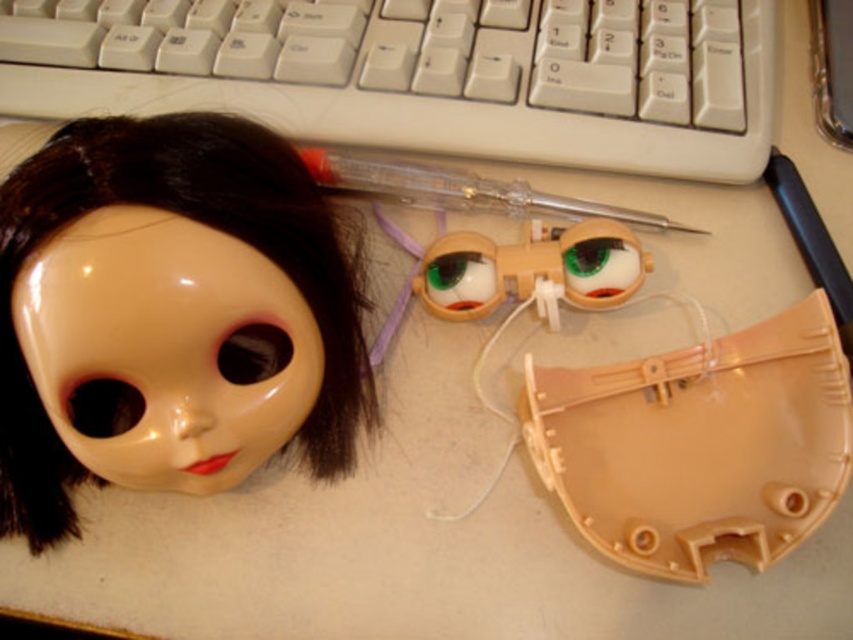
Question: Does white plastic keyboard at upper center have a smaller size compared to translucent plastic goggles at center?

Choices:
 (A) yes
 (B) no

Answer: (B)

Question: Which point is farther from the camera taking this photo?

Choices:
 (A) (618, 280)
 (B) (80, 380)

Answer: (A)

Question: Among these objects, which one is farthest from the camera?

Choices:
 (A) transparent plastic pen at center
 (B) translucent plastic goggles at center

Answer: (A)

Question: Is glossy plastic doll head at upper left smaller than translucent plastic goggles at center?

Choices:
 (A) yes
 (B) no

Answer: (B)

Question: Which point is farther from the camera taking this photo?

Choices:
 (A) (598, 236)
 (B) (74, 376)
 (C) (473, 205)
 (D) (605, 115)

Answer: (D)

Question: Does glossy plastic doll head at upper left have a greater width compared to translucent plastic goggles at center?

Choices:
 (A) no
 (B) yes

Answer: (B)